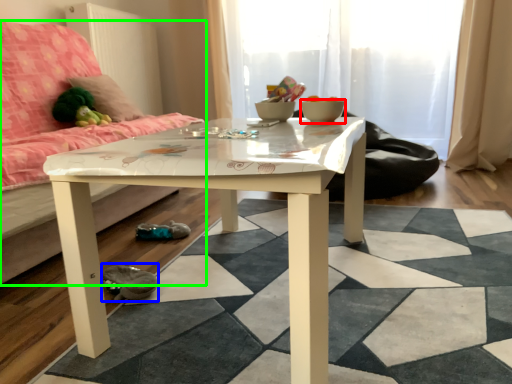
Question: Based on their relative distances, which object is farther from bowl (highlighted by a red box)? Choose from shoe (highlighted by a blue box) and studio couch (highlighted by a green box).

Choices:
 (A) shoe
 (B) studio couch

Answer: (B)